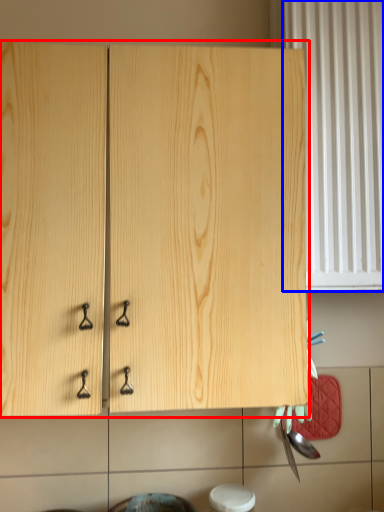
Question: Among these objects, which one is nearest to the camera, cabinetry (highlighted by a red box) or curtain (highlighted by a blue box)?

Choices:
 (A) cabinetry
 (B) curtain

Answer: (A)